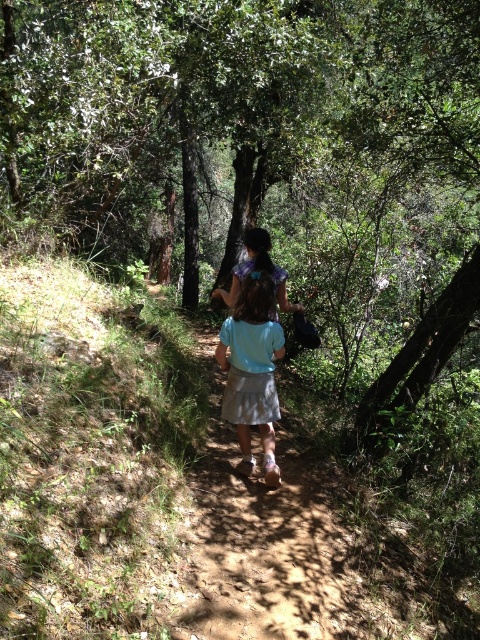
Is green leafy tree at center closer to the viewer compared to light blue fabric at center?

Yes, it is.

Image resolution: width=480 pixels, height=640 pixels. Identify the location of green leafy tree at center. (254, 148).

Locate an element on the screen. The height and width of the screenshot is (640, 480). green leafy tree at center is located at coordinates (254, 148).

Can you confirm if green leafy tree at center is shorter than light blue fabric dress at center?

No, green leafy tree at center is not shorter than light blue fabric dress at center.

Between point (106, 4) and point (252, 392), which one is positioned behind?

Positioned behind is point (106, 4).

This screenshot has height=640, width=480. Describe the element at coordinates (254, 148) in the screenshot. I see `green leafy tree at center` at that location.

Find the location of a particular element. The height and width of the screenshot is (640, 480). green leafy tree at center is located at coordinates (254, 148).

Who is shorter, light blue fabric shirt at center or light blue fabric dress at center?

With less height is light blue fabric dress at center.

Who is positioned more to the left, light blue fabric shirt at center or light blue fabric dress at center?

light blue fabric shirt at center

Which is in front, point (237, 328) or point (231, 353)?

Point (237, 328) is in front.

Where is `light blue fabric shirt at center`? The image size is (480, 640). light blue fabric shirt at center is located at coordinates (252, 371).